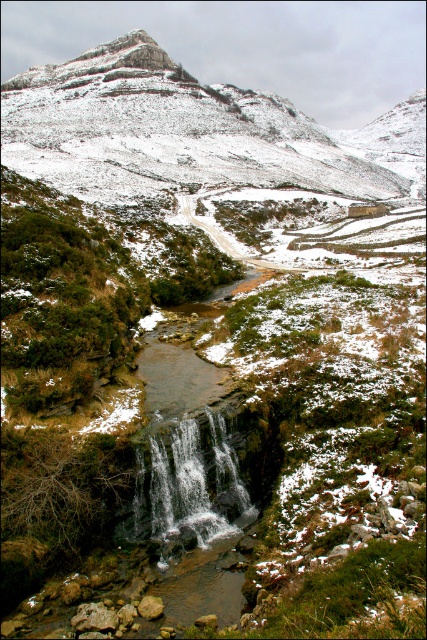
Can you confirm if snowy rocky mountain at center is positioned below white frothy water at center?

Incorrect, snowy rocky mountain at center is not positioned below white frothy water at center.

Does point (148, 44) lie in front of point (177, 492)?

No, it is not.

Is point (377, 138) positioned behind point (207, 493)?

That is True.

At what (x,y) coordinates should I click in order to perform the action: click on snowy rocky mountain at center. Please return your answer as a coordinate pair (x, y). The height and width of the screenshot is (640, 427). Looking at the image, I should click on (190, 132).